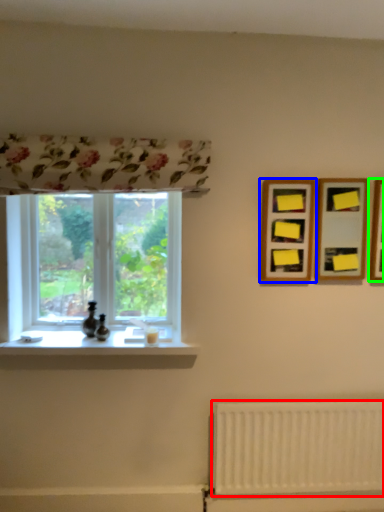
Question: Which is farther away from radiator (highlighted by a red box)? picture frame (highlighted by a blue box) or picture frame (highlighted by a green box)?

Choices:
 (A) picture frame
 (B) picture frame

Answer: (B)